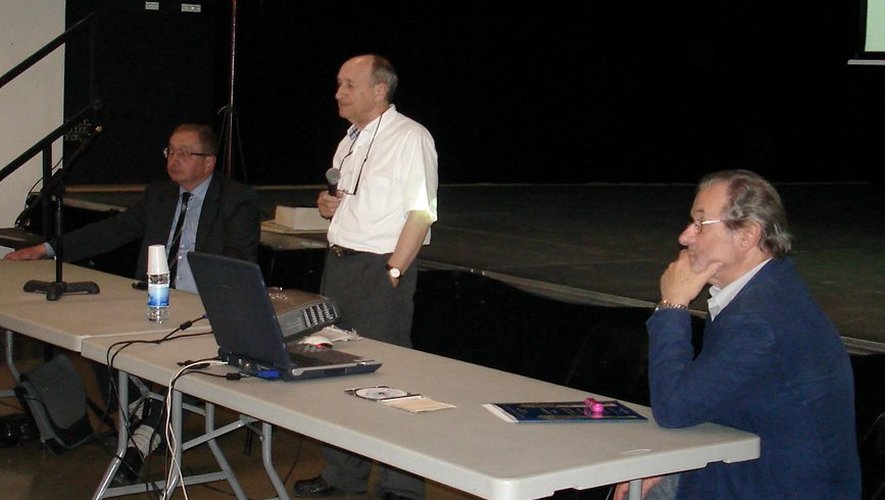
Where is `computer`? The image size is (885, 500). computer is located at coordinates (297, 377).